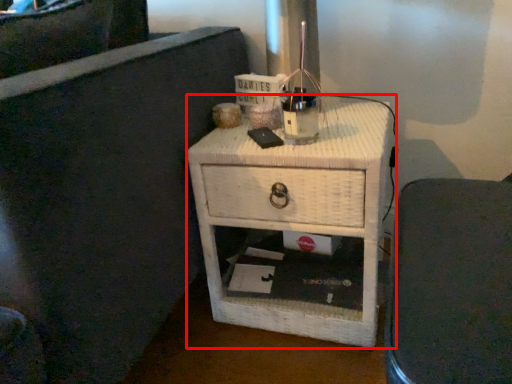
Question: Where is nightstand (annotated by the red box) located in relation to furniture in the image?

Choices:
 (A) right
 (B) left

Answer: (B)